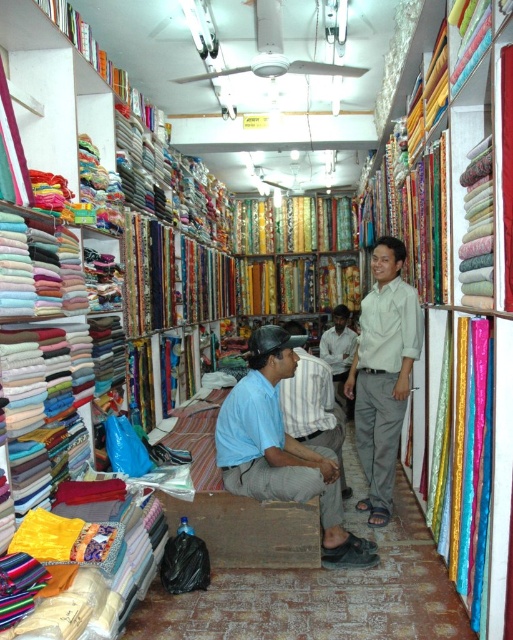
Question: Among these points, which one is farthest from the camera?

Choices:
 (A) (310, 364)
 (B) (384, 241)
 (C) (235, 465)
 (D) (351, 348)

Answer: (D)

Question: Among these objects, which one is nearest to the camera?

Choices:
 (A) striped cotton shirt at center
 (B) blue cotton shirt at center
 (C) light beige cotton shirt at center
 (D) light brown shirt at center

Answer: (B)

Question: Is blue cotton shirt at center to the right of light beige cotton shirt at center from the viewer's perspective?

Choices:
 (A) no
 (B) yes

Answer: (A)

Question: Which of these objects is positioned farthest from the light brown shirt at center?

Choices:
 (A) striped cotton shirt at center
 (B) light beige cotton shirt at center

Answer: (A)

Question: Does blue cotton shirt at center have a lesser width compared to light beige cotton shirt at center?

Choices:
 (A) yes
 (B) no

Answer: (B)

Question: Can you confirm if striped cotton shirt at center is thinner than light brown shirt at center?

Choices:
 (A) no
 (B) yes

Answer: (A)